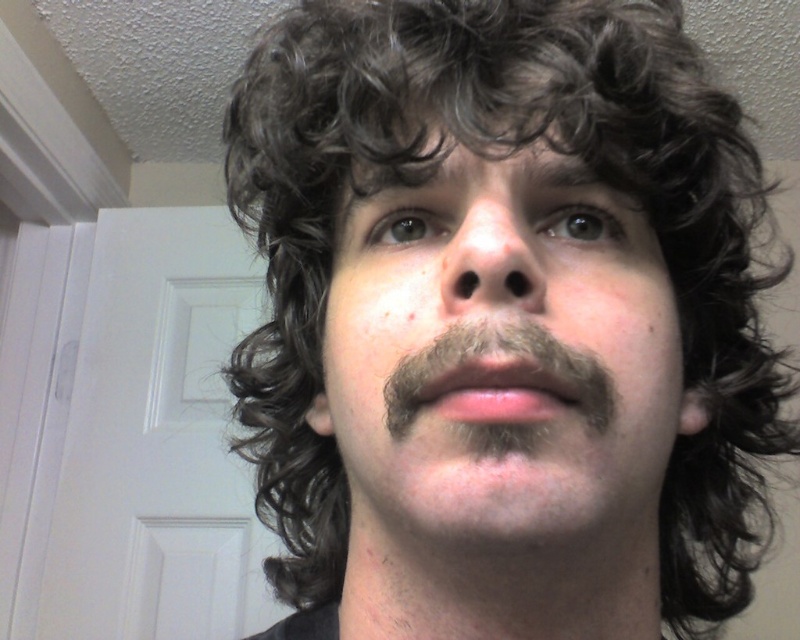
Question: Does dark curly hair at center have a larger size compared to dark brown fuzzy mustache at center?

Choices:
 (A) no
 (B) yes

Answer: (B)

Question: Among these points, which one is farthest from the camera?

Choices:
 (A) (556, 339)
 (B) (476, 236)

Answer: (A)

Question: Which point appears farthest from the camera in this image?

Choices:
 (A) (580, 200)
 (B) (612, 404)

Answer: (A)

Question: Is dark curly hair at center smaller than dark brown fuzzy mustache at center?

Choices:
 (A) yes
 (B) no

Answer: (B)

Question: Is dark curly hair at center smaller than dark brown fuzzy mustache at center?

Choices:
 (A) no
 (B) yes

Answer: (A)